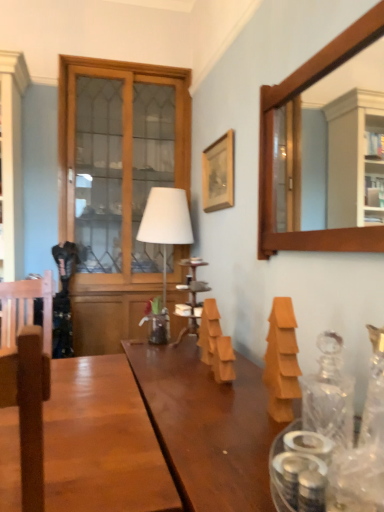
Question: From a real-world perspective, is wooden frame mirror at upper right on top of wooden picture frame at upper center?

Choices:
 (A) yes
 (B) no

Answer: (B)

Question: Could you tell me if wooden frame mirror at upper right is facing wooden picture frame at upper center?

Choices:
 (A) no
 (B) yes

Answer: (A)

Question: Does wooden frame mirror at upper right come behind wooden picture frame at upper center?

Choices:
 (A) yes
 (B) no

Answer: (B)

Question: Is wooden frame mirror at upper right oriented away from wooden picture frame at upper center?

Choices:
 (A) no
 (B) yes

Answer: (A)

Question: Can wooden picture frame at upper center be found inside wooden frame mirror at upper right?

Choices:
 (A) yes
 (B) no

Answer: (B)

Question: From the image's perspective, relative to white matte table lamp at center, is brown wood swivel chair at left above or below?

Choices:
 (A) below
 (B) above

Answer: (A)

Question: Is brown wood swivel chair at left in front of or behind white matte table lamp at center in the image?

Choices:
 (A) front
 (B) behind

Answer: (A)

Question: Considering the positions of brown wood swivel chair at left and white matte table lamp at center in the image, is brown wood swivel chair at left wider or thinner than white matte table lamp at center?

Choices:
 (A) thin
 (B) wide

Answer: (B)

Question: Is brown wood swivel chair at left to the left or to the right of white matte table lamp at center in the image?

Choices:
 (A) left
 (B) right

Answer: (A)

Question: Is wooden picture frame at upper center wider or thinner than orange matte wooden blocks at center, which is the 2th wood from right to left?

Choices:
 (A) wide
 (B) thin

Answer: (B)

Question: In the image, is wooden picture frame at upper center on the left side or the right side of orange matte wooden blocks at center, the first wood positioned from the left?

Choices:
 (A) left
 (B) right

Answer: (B)

Question: Relative to orange matte wooden blocks at center, placed as the 1th wood when sorted from back to front, is wooden picture frame at upper center in front or behind?

Choices:
 (A) front
 (B) behind

Answer: (B)

Question: From their relative heights in the image, would you say wooden picture frame at upper center is taller or shorter than orange matte wooden blocks at center, which is the 2th wood from right to left?

Choices:
 (A) tall
 (B) short

Answer: (A)

Question: Considering the positions of wooden cabinet with glass doors at left and orange matte wooden blocks at center, which is the 2th wood from right to left, in the image, is wooden cabinet with glass doors at left taller or shorter than orange matte wooden blocks at center, which is the 2th wood from right to left,?

Choices:
 (A) short
 (B) tall

Answer: (B)

Question: In terms of width, does wooden cabinet with glass doors at left look wider or thinner when compared to orange matte wooden blocks at center, acting as the 2th wood starting from the front?

Choices:
 (A) thin
 (B) wide

Answer: (B)